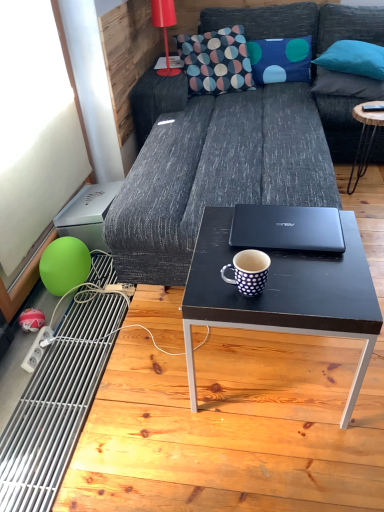
Question: Could matte red lamp at upper left be considered to be inside dark gray fabric couch at center?

Choices:
 (A) no
 (B) yes

Answer: (B)

Question: Is dark gray fabric couch at center facing towards matte red lamp at upper left?

Choices:
 (A) no
 (B) yes

Answer: (A)

Question: From a real-world perspective, is dark gray fabric couch at center physically below matte red lamp at upper left?

Choices:
 (A) yes
 (B) no

Answer: (A)

Question: From the image's perspective, would you say dark gray fabric couch at center is shown under matte red lamp at upper left?

Choices:
 (A) yes
 (B) no

Answer: (A)

Question: Is the surface of dark gray fabric couch at center in direct contact with matte red lamp at upper left?

Choices:
 (A) no
 (B) yes

Answer: (A)

Question: From a real-world perspective, is black wood coffee table at right, which is the 1th coffee table in top-to-bottom order, positioned above or below matte green balloon at lower left?

Choices:
 (A) above
 (B) below

Answer: (A)

Question: Looking at their shapes, would you say black wood coffee table at right, which is the 1th coffee table in top-to-bottom order, is wider or thinner than matte green balloon at lower left?

Choices:
 (A) thin
 (B) wide

Answer: (B)

Question: Relative to matte green balloon at lower left, is black wood coffee table at right, which is the 1th coffee table in top-to-bottom order, in front or behind?

Choices:
 (A) front
 (B) behind

Answer: (B)

Question: Is point (367, 135) positioned closer to the camera than point (61, 258)?

Choices:
 (A) farther
 (B) closer

Answer: (A)

Question: Looking at their shapes, would you say patterned fabric pillow at upper center is wider or thinner than white dotted ceramic mug at center?

Choices:
 (A) thin
 (B) wide

Answer: (B)

Question: Is patterned fabric pillow at upper center bigger or smaller than white dotted ceramic mug at center?

Choices:
 (A) big
 (B) small

Answer: (A)

Question: From the image's perspective, relative to white dotted ceramic mug at center, is patterned fabric pillow at upper center above or below?

Choices:
 (A) below
 (B) above

Answer: (B)

Question: Considering their positions, is patterned fabric pillow at upper center located in front of or behind white dotted ceramic mug at center?

Choices:
 (A) front
 (B) behind

Answer: (B)

Question: Is black wood coffee table at right, arranged as the second coffee table when viewed from the front, situated inside black matte coffee table at center, which is counted as the 1th coffee table, starting from the left, or outside?

Choices:
 (A) inside
 (B) outside

Answer: (B)

Question: Is black wood coffee table at right, which appears as the first coffee table when viewed from the right, in front of or behind black matte coffee table at center, acting as the 2th coffee table starting from the top, in the image?

Choices:
 (A) behind
 (B) front

Answer: (A)